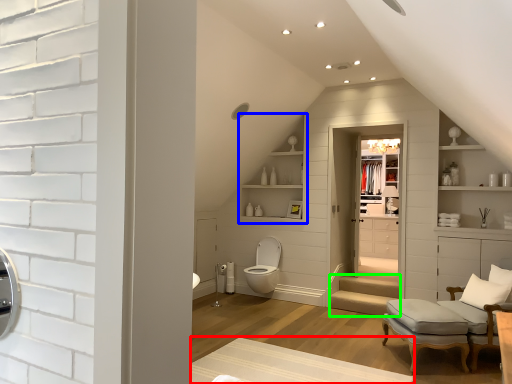
Question: Which is nearer to the plain (highlighted by a red box)? shelf (highlighted by a blue box) or stairwell (highlighted by a green box).

Choices:
 (A) shelf
 (B) stairwell

Answer: (B)